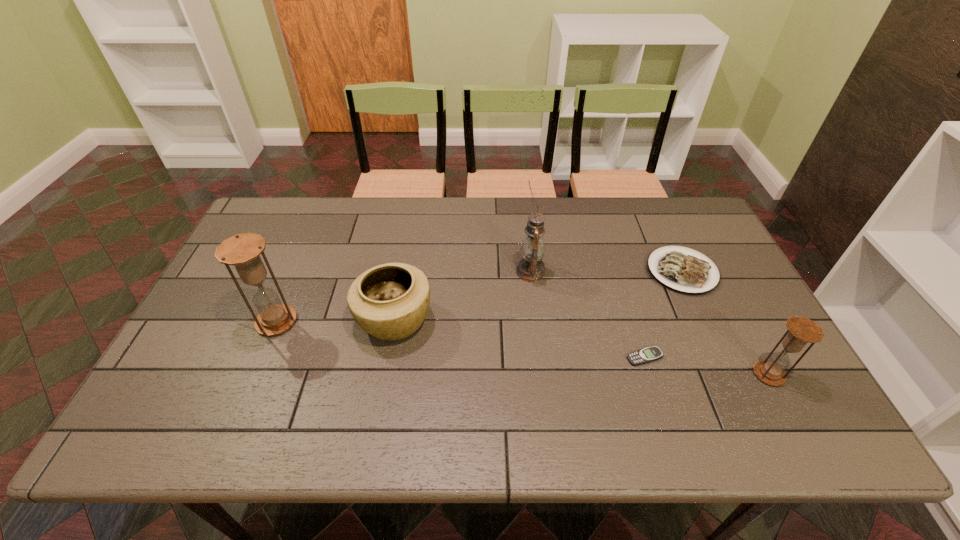
Find the location of a particular element. blank area in the image that satisfies the following two spatial constraints: 1. on the back side of the farther hourglass; 2. on the right side of the plate is located at coordinates (298, 271).